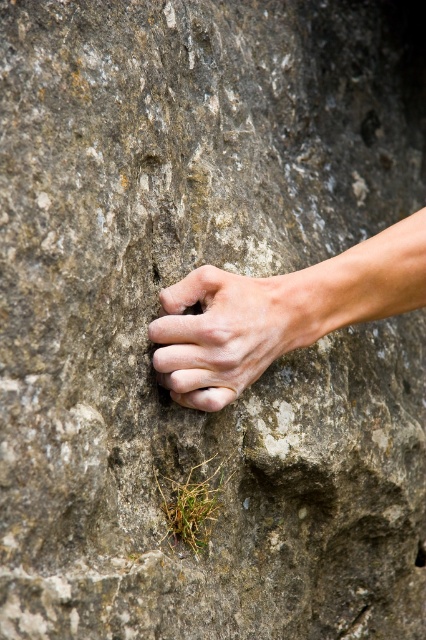
Does smooth skin hand at center appear on the left side of white matte hand at center?

In fact, smooth skin hand at center is to the right of white matte hand at center.

Based on the photo, does smooth skin hand at center have a lesser width compared to white matte hand at center?

In fact, smooth skin hand at center might be wider than white matte hand at center.

Looking at this image, who is more distant from viewer, (226, 296) or (264, 330)?

Positioned behind is point (264, 330).

Locate an element on the screen. This screenshot has height=640, width=426. smooth skin hand at center is located at coordinates (279, 312).